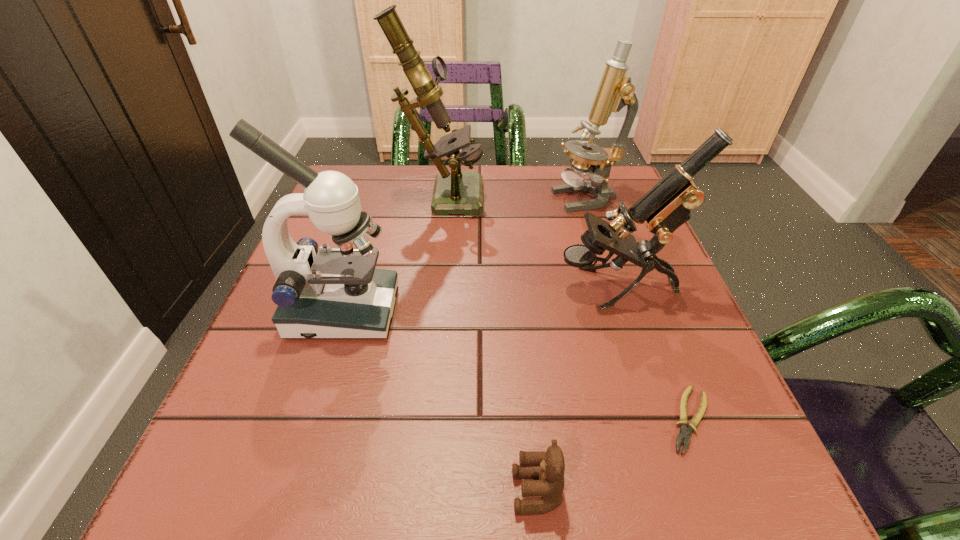
Where is `the fourth object from right to left`? The width and height of the screenshot is (960, 540). the fourth object from right to left is located at coordinates (549, 467).

Where is `the second shortest object`? the second shortest object is located at coordinates (549, 467).

Where is `pliers`? The height and width of the screenshot is (540, 960). pliers is located at coordinates (684, 433).

Identify the location of the second nearest object. (684, 433).

Find the location of `vacant space located 0.140m on the face of the teddy bear`. vacant space located 0.140m on the face of the teddy bear is located at coordinates (404, 492).

Find the location of a particular element. The width and height of the screenshot is (960, 540). vacant space located 0.140m on the face of the teddy bear is located at coordinates (404, 492).

Identify the location of vacant space positioned 0.150m on the face of the teddy bear. (396, 492).

This screenshot has height=540, width=960. What are the coordinates of `blank space located 0.180m on the left of the fifth farthest object` in the screenshot? It's located at (540, 420).

Locate an element on the screen. teddy bear that is at the near edge is located at coordinates (549, 467).

Locate an element on the screen. The width and height of the screenshot is (960, 540). pliers situated at the near edge is located at coordinates (684, 433).